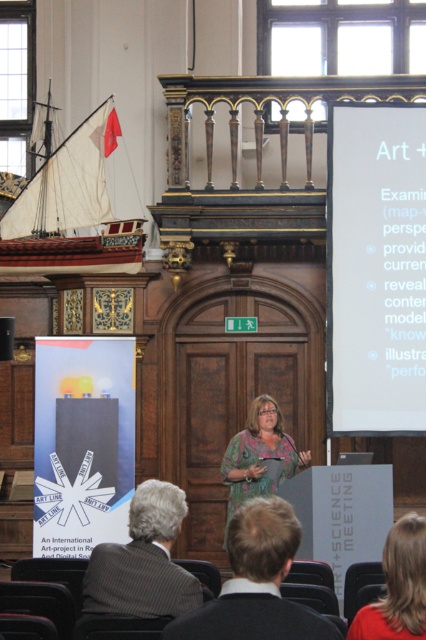
You are an attendee at the ARTSCIENCE MEETING. You notice two items in the room that are important for the presentation. The white paper at upper right contains the speaker notes, and the wooden model ship at left is part of the presentation decor. Which item is taller?

The wooden model ship at left is taller than the white paper at upper right.

You are an attendee at the ART SCIENCE MEETING. You see a white paper at upper right and a wooden model ship at left. Which object is located more to the right side of the scene?

The white paper at upper right is positioned on the right side of the wooden model ship at left, so it is more to the right side of the scene.